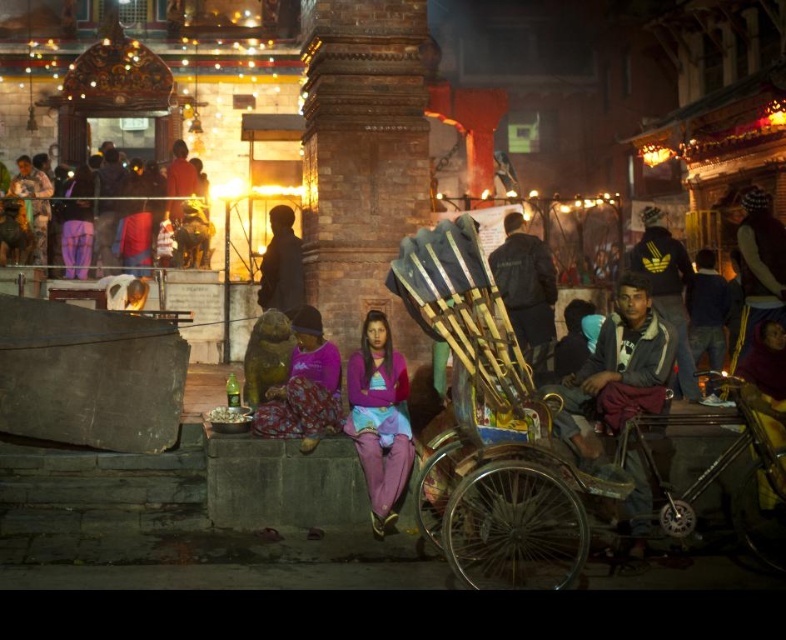
Is gray fabric jacket at right below matte purple shirt at upper left?

Yes, gray fabric jacket at right is below matte purple shirt at upper left.

Based on the photo, does gray fabric jacket at right have a lesser width compared to matte purple shirt at upper left?

Indeed, gray fabric jacket at right has a lesser width compared to matte purple shirt at upper left.

Locate an element on the screen. This screenshot has width=786, height=640. gray fabric jacket at right is located at coordinates (619, 369).

Identify the location of gray fabric jacket at right. Image resolution: width=786 pixels, height=640 pixels. (619, 369).

Which is below, gray fabric jacket at right or purple fabric pants at center?

purple fabric pants at center is below.

Measure the distance between gray fabric jacket at right and camera.

gray fabric jacket at right and camera are 31.23 meters apart from each other.

Locate an element on the screen. Image resolution: width=786 pixels, height=640 pixels. gray fabric jacket at right is located at coordinates (619, 369).

Does purple fleece jacket at center have a larger size compared to dark brown leather jacket at upper right?

No, purple fleece jacket at center is not bigger than dark brown leather jacket at upper right.

Who is lower down, purple fleece jacket at center or dark brown leather jacket at upper right?

purple fleece jacket at center

I want to click on purple fleece jacket at center, so click(x=379, y=419).